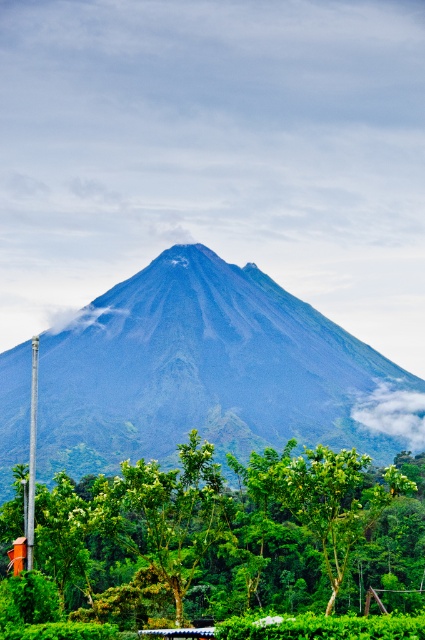
Can you confirm if green leafy tree at center is positioned above metallic pole at left?

Incorrect, green leafy tree at center is not positioned above metallic pole at left.

Can you confirm if green leafy tree at center is thinner than metallic pole at left?

In fact, green leafy tree at center might be wider than metallic pole at left.

What do you see at coordinates (221, 540) in the screenshot? The height and width of the screenshot is (640, 425). I see `green leafy tree at center` at bounding box center [221, 540].

Where is `green leafy tree at center`? green leafy tree at center is located at coordinates (221, 540).

Does point (96, 353) come farther from viewer compared to point (33, 340)?

Yes, it is.

Which is in front, point (218, 387) or point (36, 400)?

Point (36, 400)

Locate an element on the screen. Image resolution: width=425 pixels, height=640 pixels. dark gray volcanic rock mountain at center is located at coordinates (210, 372).

What do you see at coordinates (210, 372) in the screenshot? The width and height of the screenshot is (425, 640). I see `dark gray volcanic rock mountain at center` at bounding box center [210, 372].

Does dark gray volcanic rock mountain at center have a greater width compared to green leafy tree at center?

Indeed, dark gray volcanic rock mountain at center has a greater width compared to green leafy tree at center.

The image size is (425, 640). What do you see at coordinates (210, 372) in the screenshot? I see `dark gray volcanic rock mountain at center` at bounding box center [210, 372].

Where is `dark gray volcanic rock mountain at center`? The image size is (425, 640). dark gray volcanic rock mountain at center is located at coordinates (210, 372).